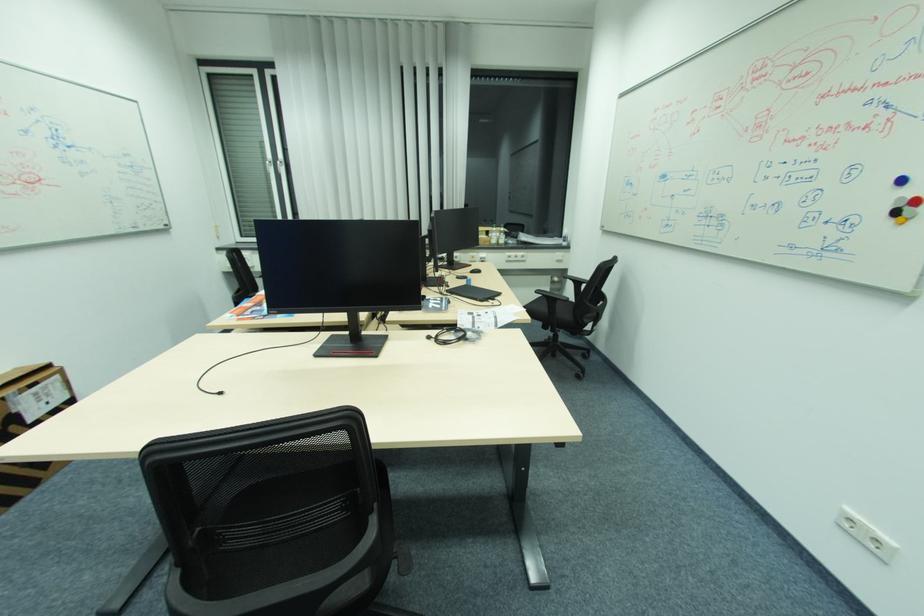
You are a GUI agent. You are given a task and a screenshot of the screen. Output one action in this format:
    pyautogui.click(x=<x>, y=<y>)
    Task: Click on the black computer mouse
    Image resolution: width=924 pixels, height=616 pixels.
    Given the screenshot: What is the action you would take?
    pyautogui.click(x=470, y=273)